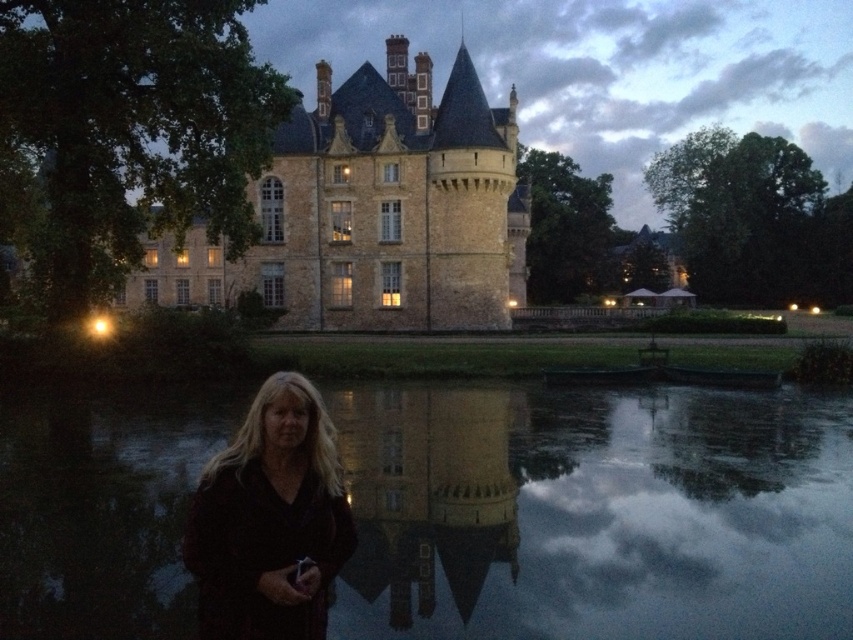
Question: Does smooth reflective water at center appear under dark brown fabric at lower center?

Choices:
 (A) no
 (B) yes

Answer: (B)

Question: Is smooth reflective water at center positioned at the back of dark brown fabric at lower center?

Choices:
 (A) no
 (B) yes

Answer: (B)

Question: Which point is closer to the camera?

Choices:
 (A) (248, 410)
 (B) (656, 412)

Answer: (A)

Question: Which object is closer to the camera taking this photo?

Choices:
 (A) smooth reflective water at center
 (B) dark brown fabric at lower center

Answer: (B)

Question: Is smooth reflective water at center wider than dark brown fabric at lower center?

Choices:
 (A) yes
 (B) no

Answer: (A)